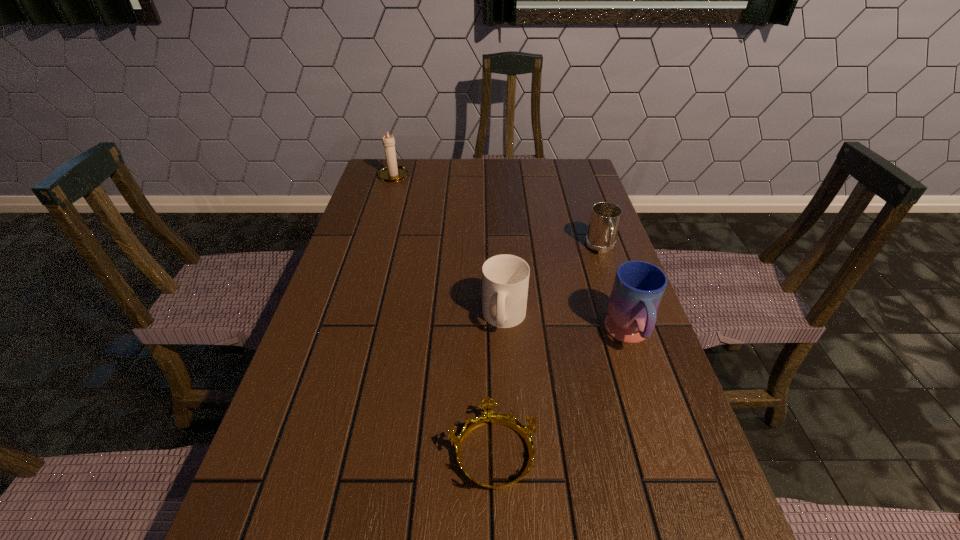
This screenshot has height=540, width=960. In order to click on vacant area that lies between the nearest object and the farthest object in this screenshot , I will do `click(444, 314)`.

This screenshot has height=540, width=960. In order to click on free point between the leftmost mug and the shortest object in this screenshot , I will do `click(498, 385)`.

Where is `object that ranks as the third closest to the second farthest object`? The image size is (960, 540). object that ranks as the third closest to the second farthest object is located at coordinates (488, 417).

This screenshot has height=540, width=960. Find the location of `the third closest object relative to the second farthest object`. the third closest object relative to the second farthest object is located at coordinates (488, 417).

Identify the location of mug that is the closest to the farthest mug. This screenshot has width=960, height=540. (638, 288).

The width and height of the screenshot is (960, 540). What are the coordinates of `mug that is the second closest to the fourth nearest object` in the screenshot? It's located at (505, 278).